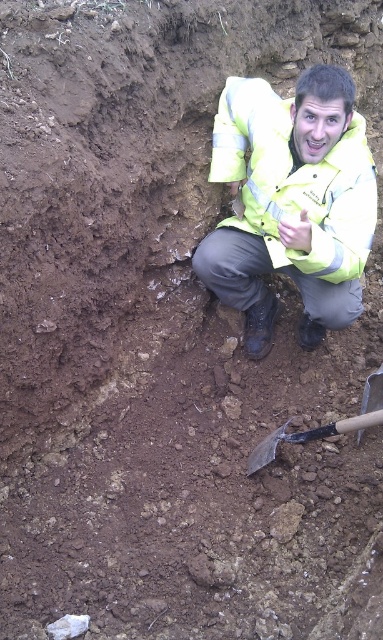
A worker is crouching in a trench. You need to locate their high visibility jacket. According to the image, where exactly is the yellow reflective jacket at center located?

The yellow reflective jacket at center is located at point (x=291, y=202).

You are a safety inspector assessing the scene. The yellow reflective jacket at center must be visible from above the wooden handle shovel at lower center. Is the current position of the jacket compliant with safety regulations requiring high visibility?

Yes, the yellow reflective jacket at center is located above the wooden handle shovel at lower center, ensuring it remains visible from above, thus complying with safety regulations.

You are a safety inspector checking the trench for proper equipment placement. According to safety guidelines, the shovel should be placed at least 1 meter away from the trench edge to prevent collapse. Is the wooden handle shovel at lower center positioned safely relative to the yellow reflective jacket at center?

The yellow reflective jacket at center is positioned on the left side of wooden handle shovel at lower center. Since the jacket is worn by the worker in the trench, the shovel is near the trench edge and less than 1 meter away from the jacket, violating safety guidelines. The wooden handle shovel at lower center should be moved further away from the trench edge.